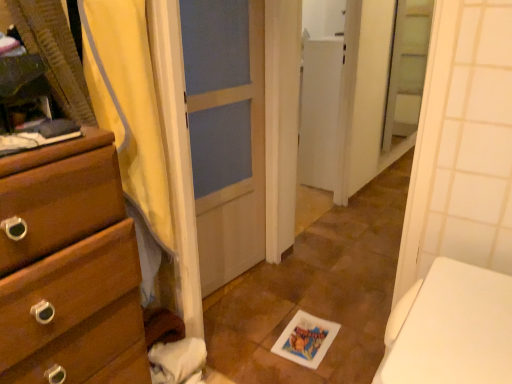
Measure the distance between point (x=131, y=191) and camera.

Point (x=131, y=191) is 1.27 meters from camera.

The height and width of the screenshot is (384, 512). I want to click on clear glass screen door at upper right, so 406,70.

The width and height of the screenshot is (512, 384). I want to click on screen door located behind the yellow fabric shower curtain at left, so click(406, 70).

Considering the sizes of yellow fabric shower curtain at left and clear glass screen door at upper right in the image, is yellow fabric shower curtain at left wider or thinner than clear glass screen door at upper right?

yellow fabric shower curtain at left is wider than clear glass screen door at upper right.

Based on their positions, is yellow fabric shower curtain at left located to the left or right of clear glass screen door at upper right?

yellow fabric shower curtain at left is to the left of clear glass screen door at upper right.

From the image's perspective, which is below, clear glass screen door at upper right or wooden chest of drawers at left?

wooden chest of drawers at left.

Is clear glass screen door at upper right far from wooden chest of drawers at left?

clear glass screen door at upper right is far away from wooden chest of drawers at left.

The height and width of the screenshot is (384, 512). What are the coordinates of `screen door that appears on the right of wooden chest of drawers at left` in the screenshot? It's located at (406, 70).

Looking at their sizes, would you say clear glass screen door at upper right is wider or thinner than wooden chest of drawers at left?

In the image, clear glass screen door at upper right appears to be more narrow than wooden chest of drawers at left.

Could you tell me if wooden chest of drawers at left is facing yellow fabric shower curtain at left?

No, wooden chest of drawers at left is not oriented towards yellow fabric shower curtain at left.

Considering the relative sizes of wooden chest of drawers at left and yellow fabric shower curtain at left in the image provided, is wooden chest of drawers at left thinner than yellow fabric shower curtain at left?

No, wooden chest of drawers at left is not thinner than yellow fabric shower curtain at left.

Who is shorter, wooden chest of drawers at left or yellow fabric shower curtain at left?

With less height is wooden chest of drawers at left.

Considering the positions of points (135, 184) and (51, 195), is point (135, 184) farther from camera compared to point (51, 195)?

Yes.

Considering the relative positions of yellow fabric shower curtain at left and wooden chest of drawers at left in the image provided, is yellow fabric shower curtain at left to the left of wooden chest of drawers at left from the viewer's perspective?

In fact, yellow fabric shower curtain at left is to the right of wooden chest of drawers at left.

Locate an element on the screen. the chest of drawers located underneath the yellow fabric shower curtain at left (from a real-world perspective) is located at coordinates (69, 267).

Is yellow fabric shower curtain at left taller than wooden chest of drawers at left?

Correct, yellow fabric shower curtain at left is much taller as wooden chest of drawers at left.

Does wooden chest of drawers at left have a larger size compared to clear glass screen door at upper right?

Correct, wooden chest of drawers at left is larger in size than clear glass screen door at upper right.

Is wooden chest of drawers at left positioned with its back to clear glass screen door at upper right?

No, wooden chest of drawers at left is not facing away from clear glass screen door at upper right.

Which is further, (111, 370) or (410, 112)?

Point (410, 112)

Looking at this image, from the image's perspective, is clear glass screen door at upper right over yellow fabric shower curtain at left?

Yes, from the image's perspective, clear glass screen door at upper right is above yellow fabric shower curtain at left.

Is clear glass screen door at upper right oriented away from yellow fabric shower curtain at left?

No, clear glass screen door at upper right is not facing away from yellow fabric shower curtain at left.

Locate an element on the screen. The width and height of the screenshot is (512, 384). screen door that is above the yellow fabric shower curtain at left (from the image's perspective) is located at coordinates (406, 70).

Is clear glass screen door at upper right behind yellow fabric shower curtain at left?

That is True.

Where is `screen door on the right of yellow fabric shower curtain at left`? The image size is (512, 384). screen door on the right of yellow fabric shower curtain at left is located at coordinates (406, 70).

Locate an element on the screen. screen door above the wooden chest of drawers at left (from the image's perspective) is located at coordinates (406, 70).

Estimate the real-world distances between objects in this image. Which object is further from wooden chest of drawers at left, clear glass screen door at upper right or yellow fabric shower curtain at left?

clear glass screen door at upper right is further to wooden chest of drawers at left.

Based on their spatial positions, is wooden chest of drawers at left or clear glass screen door at upper right further from yellow fabric shower curtain at left?

clear glass screen door at upper right lies further to yellow fabric shower curtain at left than the other object.

Which object lies nearer to the anchor point wooden chest of drawers at left, yellow fabric shower curtain at left or clear glass screen door at upper right?

Based on the image, yellow fabric shower curtain at left appears to be nearer to wooden chest of drawers at left.

Based on their spatial positions, is wooden chest of drawers at left or yellow fabric shower curtain at left further from clear glass screen door at upper right?

Among the two, wooden chest of drawers at left is located further to clear glass screen door at upper right.

Looking at the image, which one is located closer to yellow fabric shower curtain at left, clear glass screen door at upper right or wooden chest of drawers at left?

wooden chest of drawers at left is positioned closer to the anchor yellow fabric shower curtain at left.

Which object lies nearer to the anchor point clear glass screen door at upper right, yellow fabric shower curtain at left or wooden chest of drawers at left?

yellow fabric shower curtain at left.

At what (x,y) coordinates should I click in order to perform the action: click on shower curtain between wooden chest of drawers at left and clear glass screen door at upper right in the front-back direction. Please return your answer as a coordinate pair (x, y). This screenshot has width=512, height=384. Looking at the image, I should click on (130, 122).